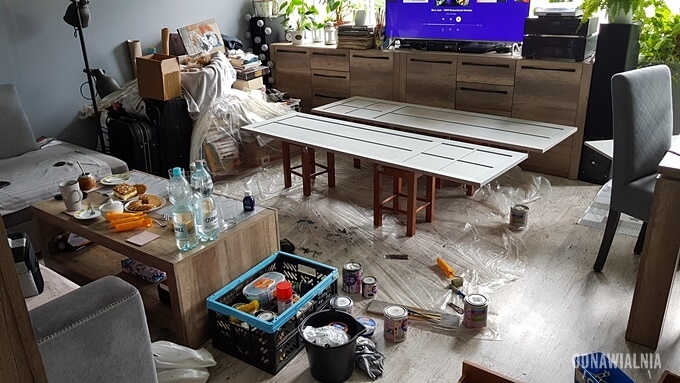
At what (x,y) coordinates should I click in order to perform the action: click on potted plants. Please return your answer as a coordinate pair (x, y). The image size is (680, 383). Looking at the image, I should click on (296, 37), (318, 29), (328, 34), (653, 51), (629, 8).